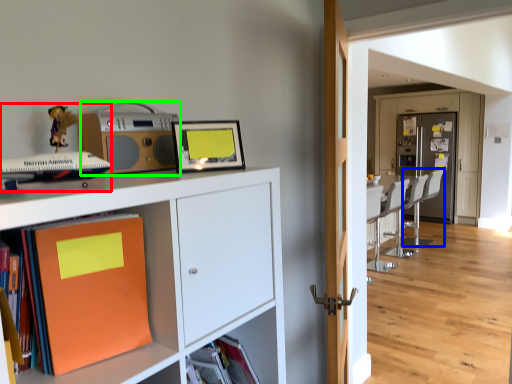
Question: Considering the real-world distances, which object is farthest from toy (highlighted by a red box)? swivel chair (highlighted by a blue box) or stereo (highlighted by a green box)?

Choices:
 (A) swivel chair
 (B) stereo

Answer: (A)